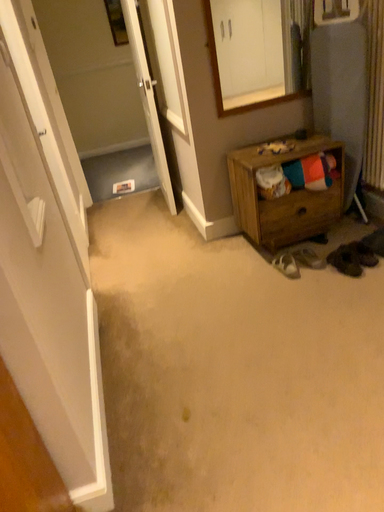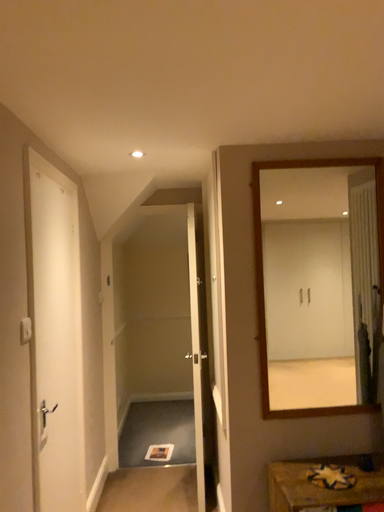
Question: Which way did the camera rotate in the video?

Choices:
 (A) rotated downward
 (B) rotated upward

Answer: (B)